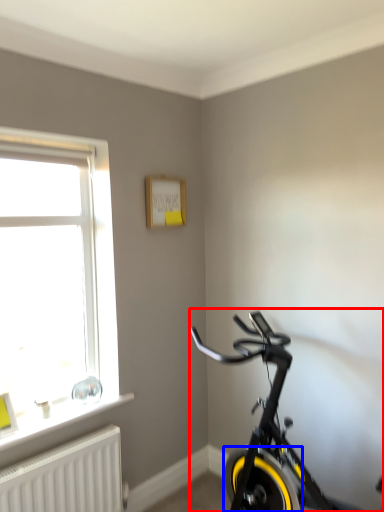
Question: Which object appears farthest to the camera in this image, bicycle (highlighted by a red box) or bicycle wheel (highlighted by a blue box)?

Choices:
 (A) bicycle
 (B) bicycle wheel

Answer: (B)